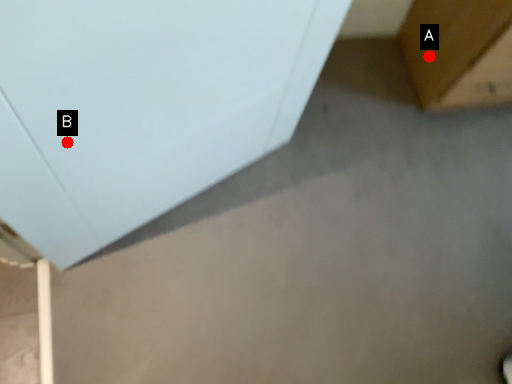
Question: Two points are circled on the image, labeled by A and B beside each circle. Which of the following is the farthest from the observer?

Choices:
 (A) A is further
 (B) B is further

Answer: (A)